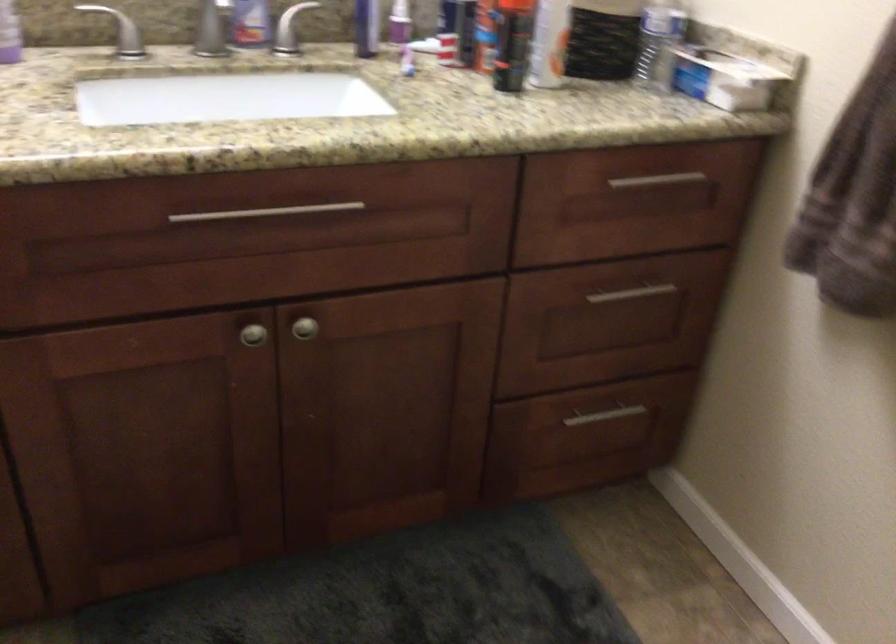
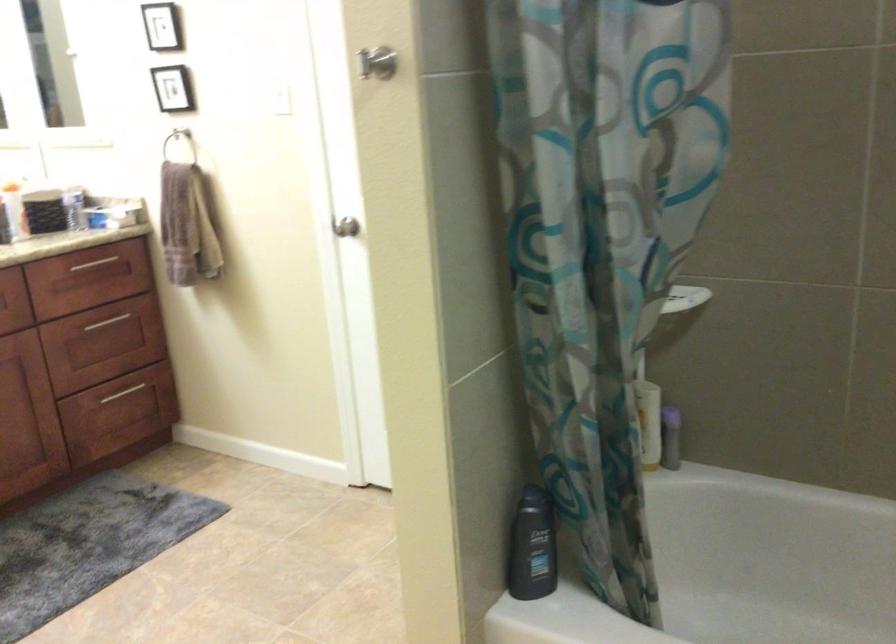
The point at (591, 424) is marked in the first image. Where is the corresponding point in the second image?

(122, 393)